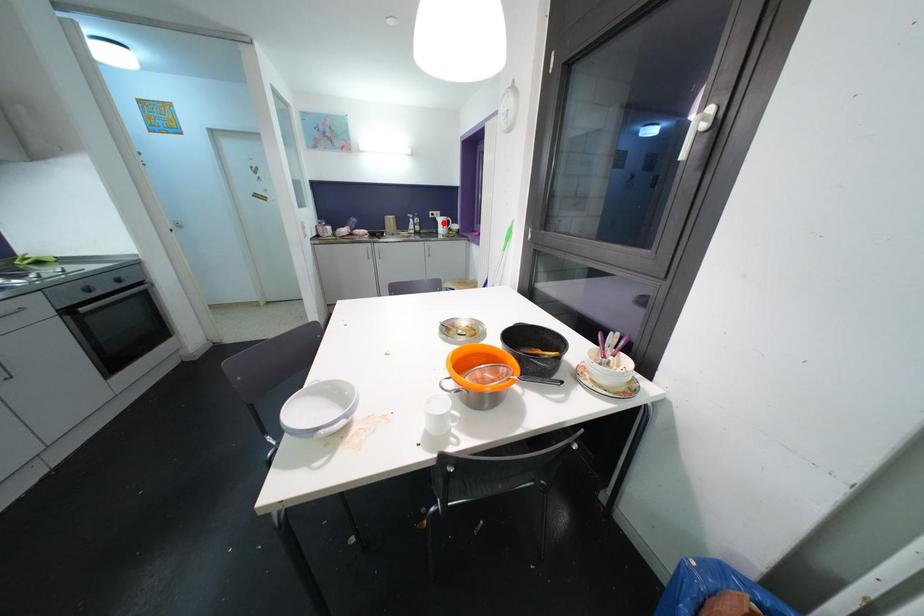
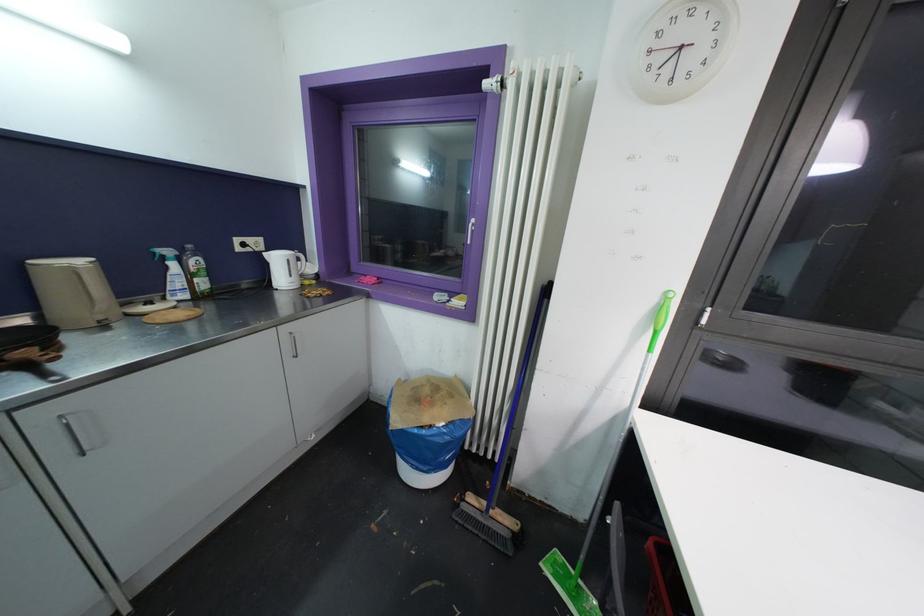
Question: I am providing you with two images of the same scene from different viewpoints. Given a red point in image1, look at the same physical point in image2. Is it:

Choices:
 (A) Closer to the viewpoint
 (B) Farther from the viewpoint

Answer: (B)